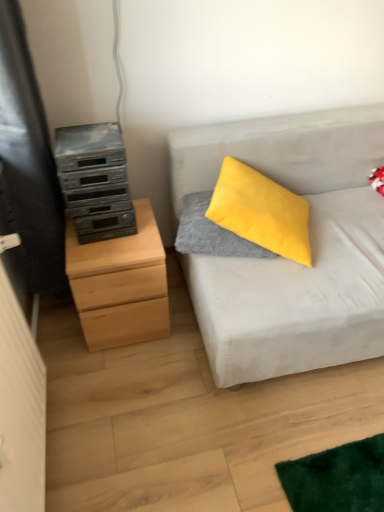
You are a GUI agent. You are given a task and a screenshot of the screen. Output one action in this format:
    pyautogui.click(x=<x>, y=<y>)
    Task: Click on the free point above natural wood chest of drawers at left (from a real-world perspective)
    The width and height of the screenshot is (384, 512).
    Given the screenshot: What is the action you would take?
    pyautogui.click(x=124, y=232)